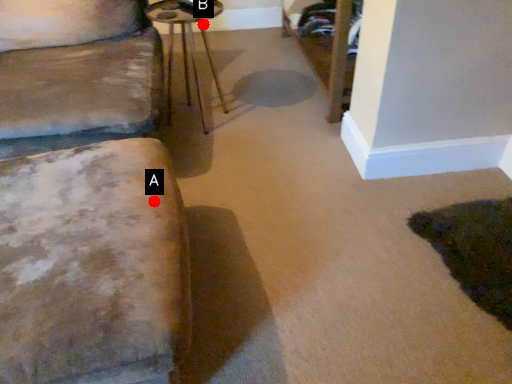
Question: Two points are circled on the image, labeled by A and B beside each circle. Which point appears closest to the camera in this image?

Choices:
 (A) A is closer
 (B) B is closer

Answer: (A)